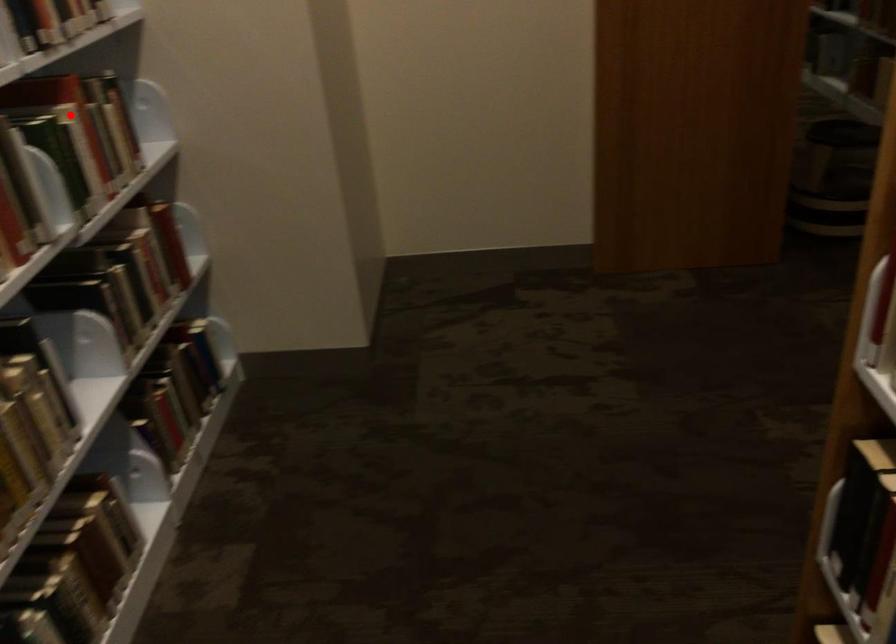
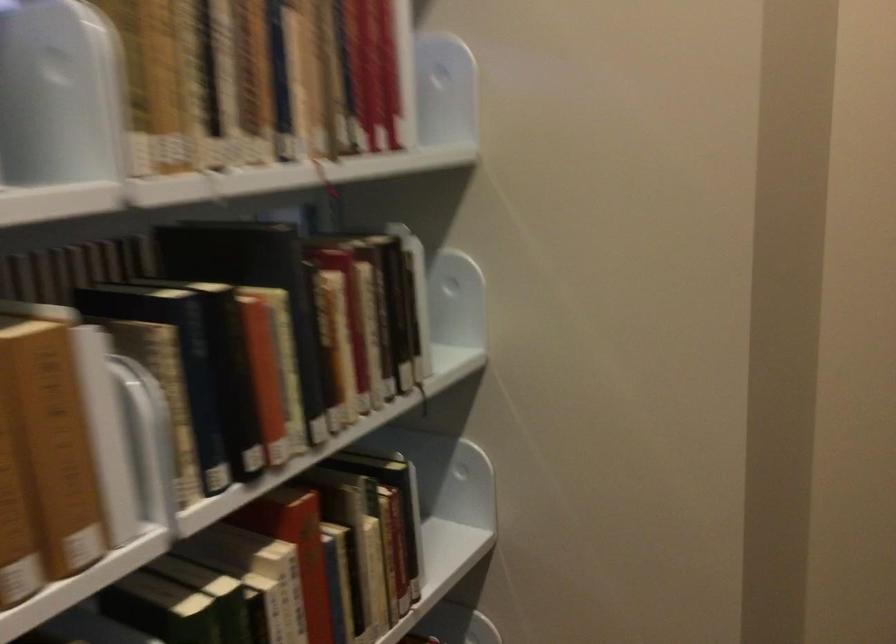
Where in the second image is the point corresponding to the highlighted location from the first image?

(289, 564)